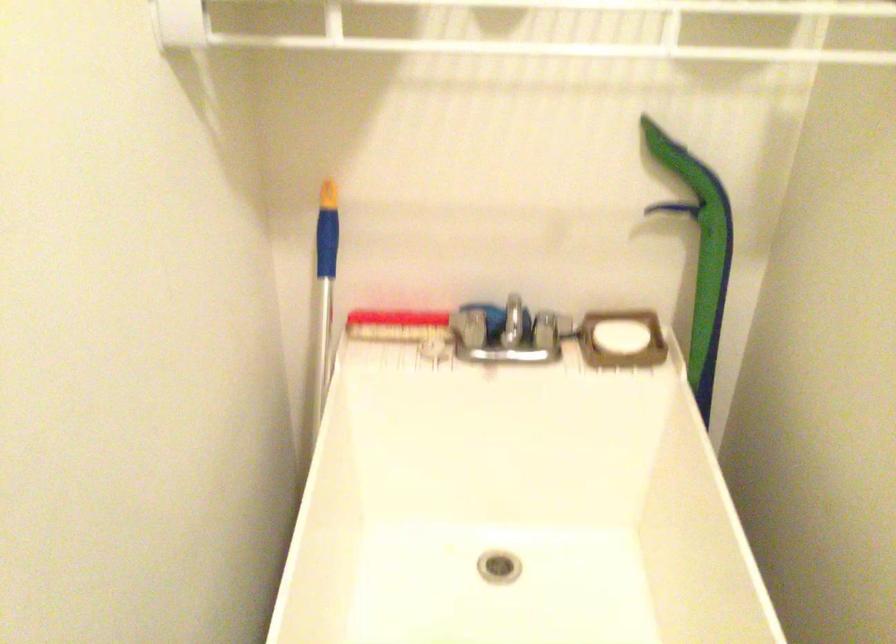
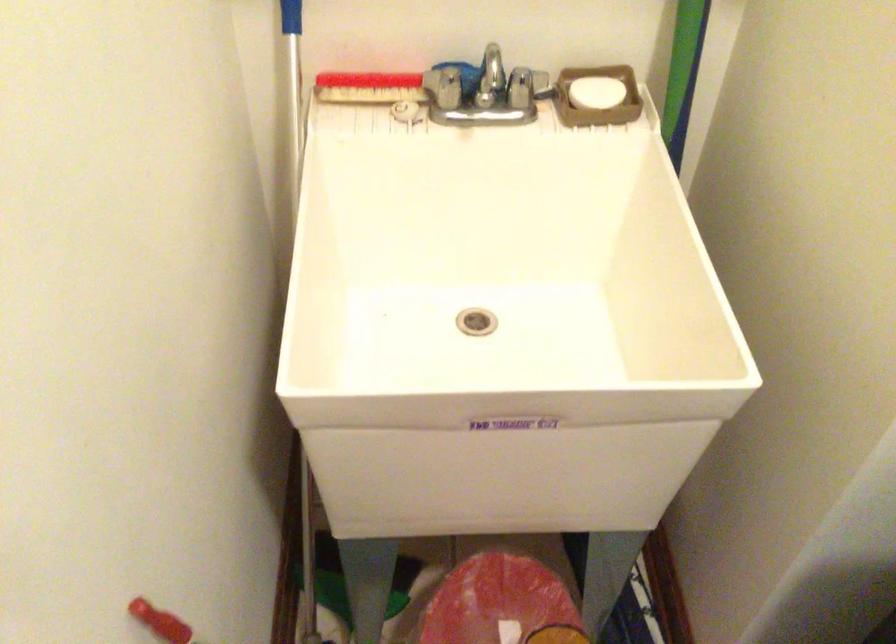
Question: The first image is from the beginning of the video and the second image is from the end. How did the camera likely rotate when shooting the video?

Choices:
 (A) Left
 (B) Right
 (C) Up
 (D) Down

Answer: (D)